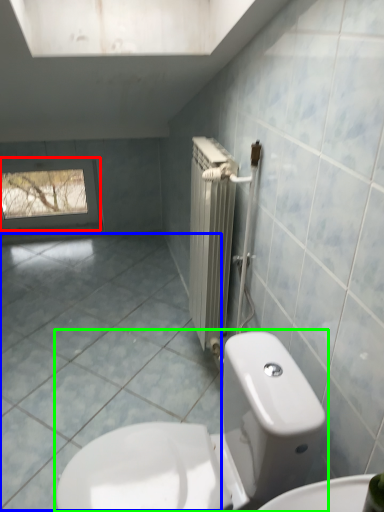
Question: Based on their relative distances, which object is farther from window (highlighted by a red box)? Choose from ceramic tile (highlighted by a blue box) and toilet (highlighted by a green box).

Choices:
 (A) ceramic tile
 (B) toilet

Answer: (B)